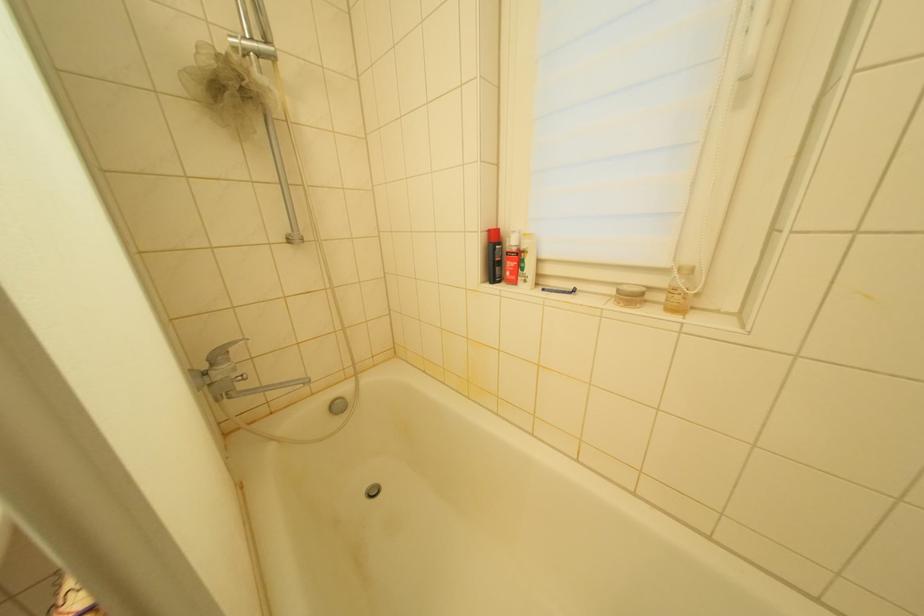
What do you see at coordinates (629, 294) in the screenshot? I see `the white bottle cap` at bounding box center [629, 294].